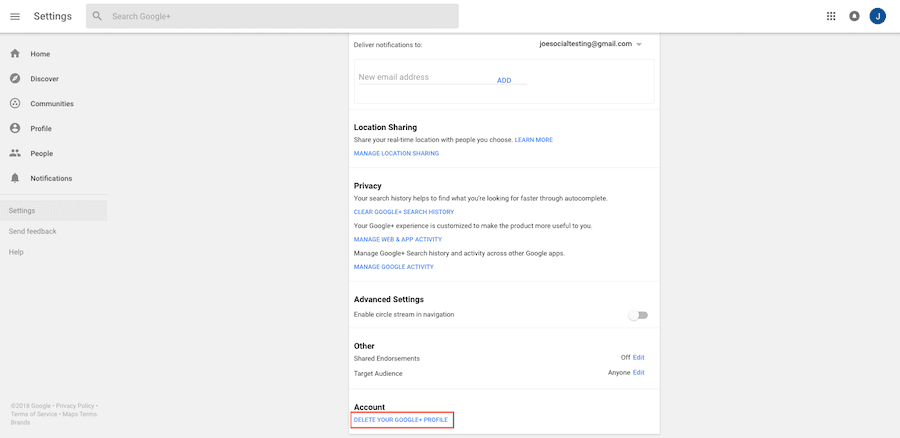
Locate an element on the screen. Image resolution: width=900 pixels, height=438 pixels. settings bar is located at coordinates (63, 16).